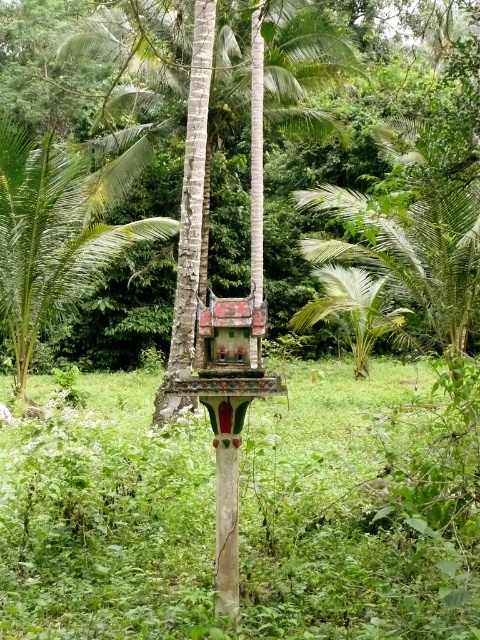
Who is higher up, green leafy palm tree at left or painted wood bird feeder at center?

Positioned higher is green leafy palm tree at left.

Which of these two, green leafy palm tree at left or painted wood bird feeder at center, stands shorter?

painted wood bird feeder at center

Is point (51, 269) positioned before point (212, 349)?

No.

This screenshot has height=640, width=480. Identify the location of green leafy palm tree at left. (51, 237).

Can you confirm if green leafy palm tree at left is wider than green leafy palm tree at center?

Correct, the width of green leafy palm tree at left exceeds that of green leafy palm tree at center.

Does green leafy palm tree at left have a lesser width compared to green leafy palm tree at center?

Incorrect, green leafy palm tree at left's width is not less than green leafy palm tree at center's.

Who is more forward, (20, 228) or (398, 314)?

Positioned in front is point (20, 228).

This screenshot has height=640, width=480. Find the location of `green leafy palm tree at left`. green leafy palm tree at left is located at coordinates (51, 237).

Does painted wood bird feeder at center have a greater height compared to green leafy palm tree at center?

Indeed, painted wood bird feeder at center has a greater height compared to green leafy palm tree at center.

At what (x,y) coordinates should I click in order to perform the action: click on painted wood bird feeder at center. Please return your answer as a coordinate pair (x, y). Looking at the image, I should click on (228, 362).

Find the location of a particular element. The height and width of the screenshot is (640, 480). painted wood bird feeder at center is located at coordinates (228, 362).